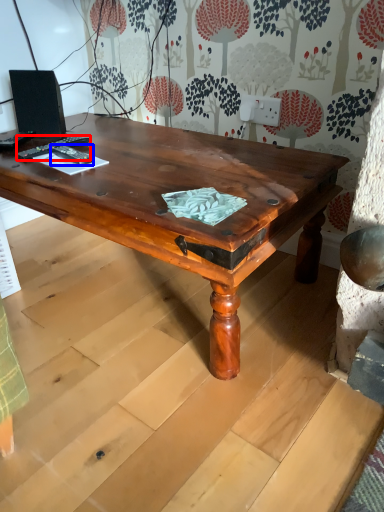
Question: Which object is closer to the camera taking this photo, remote control (highlighted by a red box) or remote control (highlighted by a blue box)?

Choices:
 (A) remote control
 (B) remote control

Answer: (B)